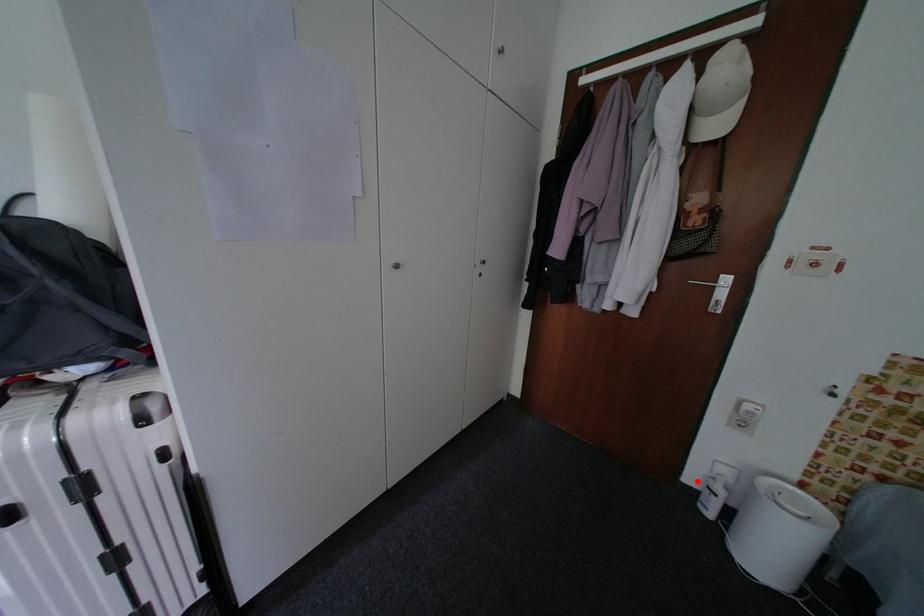
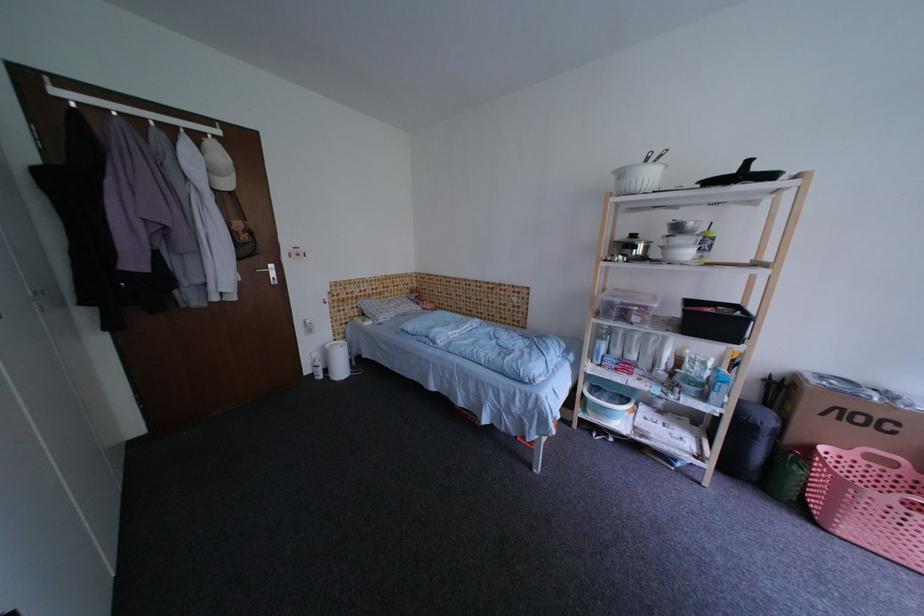
Find the pixel in the second image that matches the highlighted location in the first image.

(314, 374)